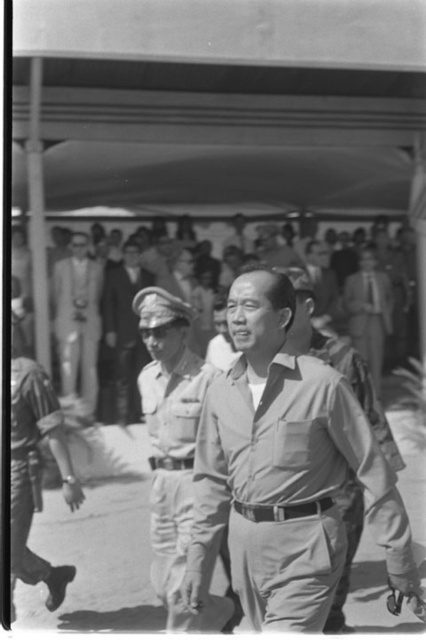
Can you confirm if matte khaki pants at center is positioned below light brown leather jacket at lower left?

Incorrect, matte khaki pants at center is not positioned below light brown leather jacket at lower left.

Between matte khaki pants at center and light brown leather jacket at lower left, which one has less height?

matte khaki pants at center

I want to click on matte khaki pants at center, so click(282, 470).

Between khaki uniform at center and light beige uniform at center, which one is positioned lower?

khaki uniform at center is below.

Who is positioned more to the left, khaki uniform at center or light beige uniform at center?

light beige uniform at center is more to the left.

What do you see at coordinates (172, 449) in the screenshot? I see `khaki uniform at center` at bounding box center [172, 449].

Image resolution: width=426 pixels, height=640 pixels. Identify the location of khaki uniform at center. (172, 449).

Is matte khaki pants at center to the right of khaki uniform at center from the viewer's perspective?

Indeed, matte khaki pants at center is positioned on the right side of khaki uniform at center.

Who is more distant from viewer, (311, 424) or (196, 628)?

The point (196, 628) is more distant.

Locate an element on the screen. matte khaki pants at center is located at coordinates (282, 470).